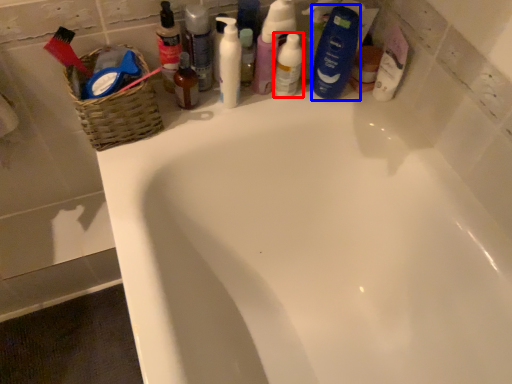
Question: Which point is closer to the camera, mouthwash (highlighted by a red box) or toiletry (highlighted by a blue box)?

Choices:
 (A) mouthwash
 (B) toiletry

Answer: (B)